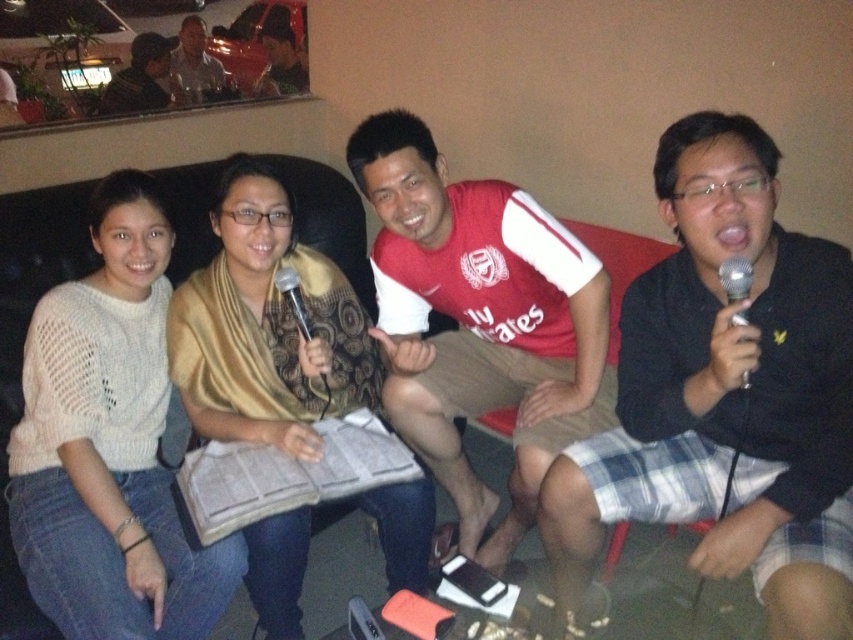
Between black fabric microphone at center and metallic silver microphone at center, which one has more height?

Standing taller between the two is black fabric microphone at center.

Is point (283, 292) behind point (289, 305)?

No, (283, 292) is in front of (289, 305).

What do you see at coordinates (294, 300) in the screenshot? I see `black fabric microphone at center` at bounding box center [294, 300].

This screenshot has height=640, width=853. I want to click on black fabric microphone at center, so click(294, 300).

Is black matte shirt at right smaller than red jersey at center?

Yes, black matte shirt at right is smaller than red jersey at center.

Between black matte shirt at right and red jersey at center, which one appears on the left side from the viewer's perspective?

From the viewer's perspective, red jersey at center appears more on the left side.

Which is in front, point (662, 436) or point (532, 365)?

Point (662, 436) is more forward.

Where is `black matte shirt at right`? This screenshot has height=640, width=853. black matte shirt at right is located at coordinates (726, 394).

Which is behind, point (180, 100) or point (292, 314)?

The point (180, 100) is more distant.

Is matte black shirt at upper left taller than metallic silver microphone at center?

Yes, matte black shirt at upper left is taller than metallic silver microphone at center.

Is point (177, 72) positioned before point (294, 296)?

No.

The image size is (853, 640). I want to click on matte black shirt at upper left, so click(x=193, y=65).